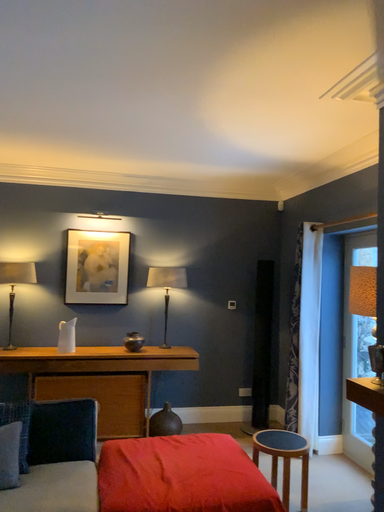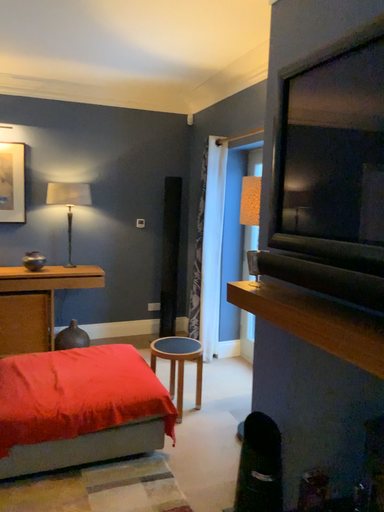
Question: Which way did the camera rotate in the video?

Choices:
 (A) rotated left
 (B) rotated right

Answer: (B)